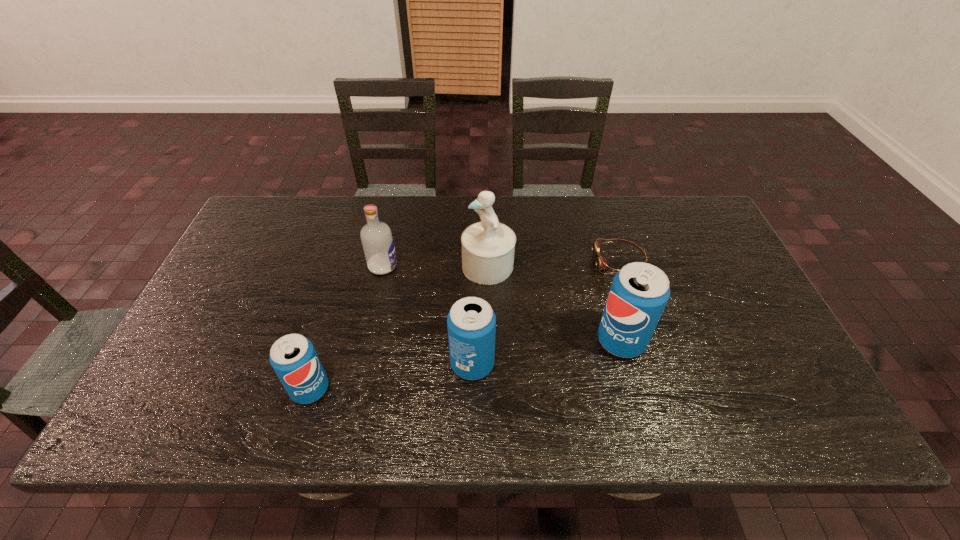
The image size is (960, 540). In order to click on vacant space situated 0.270m on the label of the second object from left to right in this screenshot , I will do `click(492, 266)`.

Where is `vacant space located at the beak of the figurine`? The height and width of the screenshot is (540, 960). vacant space located at the beak of the figurine is located at coordinates (348, 266).

The width and height of the screenshot is (960, 540). Identify the location of free space located at the beak of the figurine. (323, 266).

Locate an element on the screen. This screenshot has width=960, height=540. free space located 0.060m at the beak of the figurine is located at coordinates (441, 266).

The height and width of the screenshot is (540, 960). What are the coordinates of `vacant region located 0.230m through the lenses of the shortest object` in the screenshot? It's located at (515, 261).

Where is `vacant space located through the lenses of the shortest object`? vacant space located through the lenses of the shortest object is located at coordinates (467, 261).

At what (x,y) coordinates should I click in order to perform the action: click on free location located 0.180m through the lenses of the shortest object. Please return your answer as a coordinate pair (x, y). The image size is (960, 540). Looking at the image, I should click on (532, 261).

What are the coordinates of `vacant space at the far edge of the desktop` in the screenshot? It's located at (418, 225).

In the image, there is a desktop. Where is `vacant space at the near edge`? vacant space at the near edge is located at coordinates (240, 373).

Locate an element on the screen. vacant region at the left edge of the desktop is located at coordinates (235, 265).